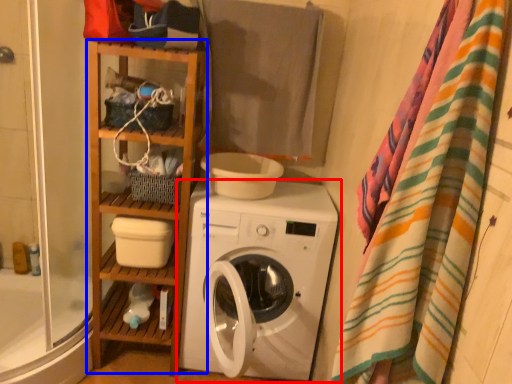
Question: Which point is further to the camera, washing machine (highlighted by a red box) or cabinet (highlighted by a blue box)?

Choices:
 (A) washing machine
 (B) cabinet

Answer: (B)